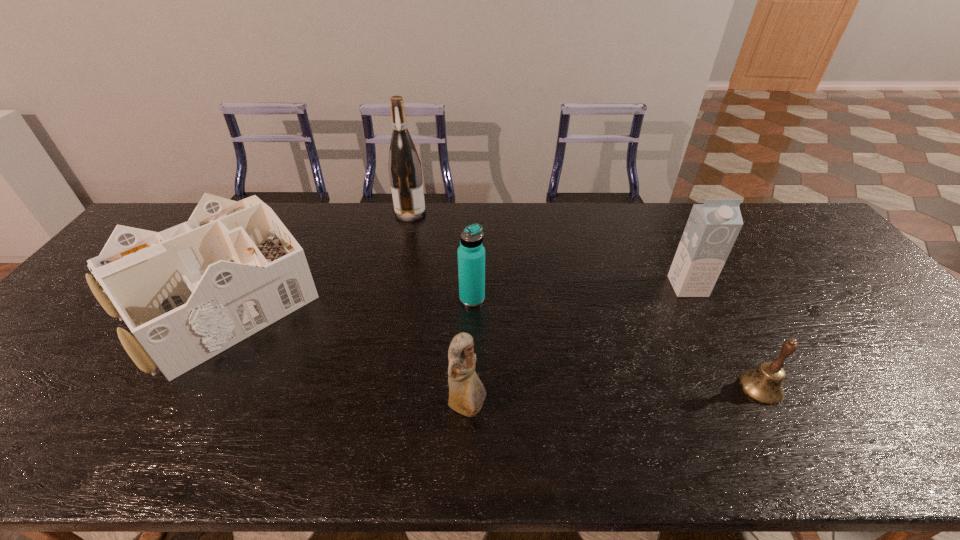
You are a GUI agent. You are given a task and a screenshot of the screen. Output one action in this format:
    pyautogui.click(x=<x>, y=<y>)
    Task: Click on the free space located 0.290m on the back of the water bottle
    
    Given the screenshot: What is the action you would take?
    pyautogui.click(x=473, y=230)

The width and height of the screenshot is (960, 540). I want to click on vacant area located on the front-facing side of the figurine, so click(522, 408).

Where is `free space located on the right of the bell`? The height and width of the screenshot is (540, 960). free space located on the right of the bell is located at coordinates (847, 388).

Locate an element on the screen. Image resolution: width=960 pixels, height=540 pixels. object that is at the far edge is located at coordinates coord(404,165).

At what (x,y) coordinates should I click in order to perform the action: click on object present at the near edge. Please return your answer as a coordinate pair (x, y). The height and width of the screenshot is (540, 960). Looking at the image, I should click on (467, 393).

What are the coordinates of `object situated at the left edge` in the screenshot? It's located at (187, 293).

I want to click on vacant area at the far edge, so click(380, 213).

In the image, there is a desktop. What are the coordinates of `free region at the near edge` in the screenshot? It's located at (329, 431).

This screenshot has height=540, width=960. Identify the location of vacant area at the left edge of the desktop. (88, 352).

Locate an element on the screen. The height and width of the screenshot is (540, 960). free space at the right edge of the desktop is located at coordinates (898, 339).